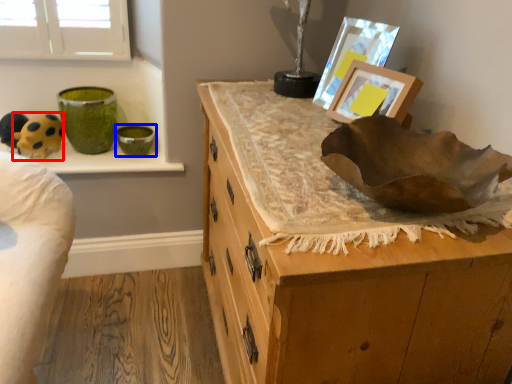
Question: Among these objects, which one is nearest to the camera, animal (highlighted by a red box) or glass bowl (highlighted by a blue box)?

Choices:
 (A) animal
 (B) glass bowl

Answer: (A)